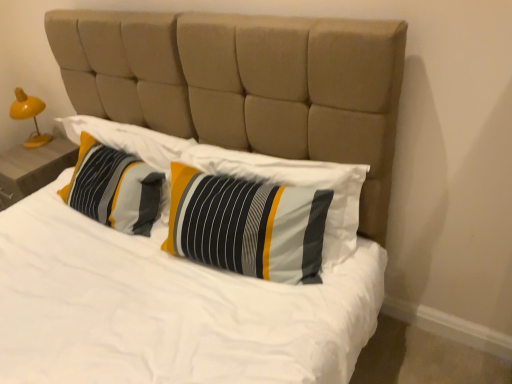
Question: Which direction should I rotate to look at striped fabric pillow at center, the second pillow in the left-to-right sequence, — up or down?

Choices:
 (A) up
 (B) down

Answer: (B)

Question: Is the position of striped fabric pillow at center, the second pillow in the left-to-right sequence, more distant than that of striped fabric pillow at center, the 1th pillow viewed from the left?

Choices:
 (A) yes
 (B) no

Answer: (B)

Question: Considering the relative sizes of striped fabric pillow at center, placed as the 1th pillow when sorted from right to left, and striped fabric pillow at center, which ranks as the 2th pillow in right-to-left order, in the image provided, is striped fabric pillow at center, placed as the 1th pillow when sorted from right to left, bigger than striped fabric pillow at center, which ranks as the 2th pillow in right-to-left order,?

Choices:
 (A) no
 (B) yes

Answer: (B)

Question: From a real-world perspective, is striped fabric pillow at center, placed as the 1th pillow when sorted from right to left, physically above striped fabric pillow at center, which ranks as the 2th pillow in right-to-left order?

Choices:
 (A) no
 (B) yes

Answer: (B)

Question: Is striped fabric pillow at center, placed as the 1th pillow when sorted from right to left, to the left of striped fabric pillow at center, which ranks as the 2th pillow in right-to-left order, from the viewer's perspective?

Choices:
 (A) no
 (B) yes

Answer: (A)

Question: Is striped fabric pillow at center, the 1th pillow viewed from the left, at the back of striped fabric pillow at center, the second pillow in the left-to-right sequence?

Choices:
 (A) yes
 (B) no

Answer: (B)

Question: From the image's perspective, does striped fabric pillow at center, the second pillow in the left-to-right sequence, appear higher than striped fabric pillow at center, the 1th pillow viewed from the left?

Choices:
 (A) no
 (B) yes

Answer: (A)

Question: Is striped fabric pillow at center, the 1th pillow viewed from the left, not inside striped fabric pillow at center, placed as the 1th pillow when sorted from right to left?

Choices:
 (A) no
 (B) yes

Answer: (B)

Question: Is striped fabric pillow at center, which ranks as the 2th pillow in right-to-left order, at the right side of striped fabric pillow at center, the second pillow in the left-to-right sequence?

Choices:
 (A) yes
 (B) no

Answer: (B)

Question: Does striped fabric pillow at center, the 1th pillow viewed from the left, have a lesser width compared to striped fabric pillow at center, the second pillow in the left-to-right sequence?

Choices:
 (A) no
 (B) yes

Answer: (A)

Question: Is striped fabric pillow at center, placed as the 1th pillow when sorted from right to left, a part of striped fabric pillow at center, which ranks as the 2th pillow in right-to-left order?

Choices:
 (A) no
 (B) yes

Answer: (A)

Question: Is striped fabric pillow at center, which ranks as the 2th pillow in right-to-left order, oriented away from striped fabric pillow at center, placed as the 1th pillow when sorted from right to left?

Choices:
 (A) no
 (B) yes

Answer: (A)

Question: Would you consider striped fabric pillow at center, which ranks as the 2th pillow in right-to-left order, to be distant from striped fabric pillow at center, placed as the 1th pillow when sorted from right to left?

Choices:
 (A) no
 (B) yes

Answer: (A)

Question: Is yellow wood nightstand at left surrounded by striped fabric pillow at center, placed as the 1th pillow when sorted from right to left?

Choices:
 (A) no
 (B) yes

Answer: (A)